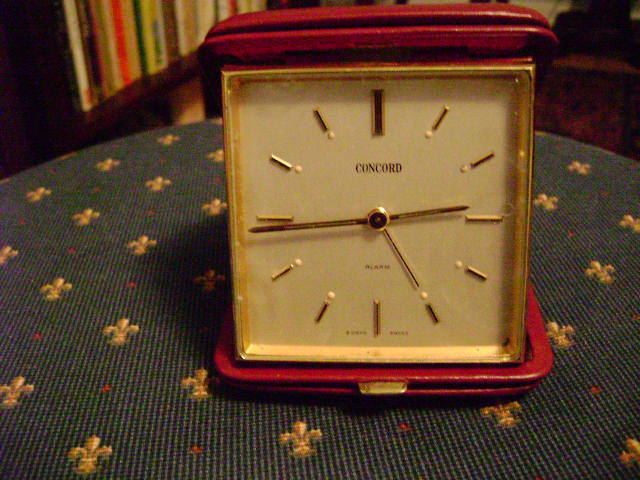
The height and width of the screenshot is (480, 640). I want to click on design on couch, so click(x=97, y=441), click(x=120, y=334), click(x=105, y=389), click(x=63, y=289), click(x=138, y=247), click(x=84, y=214).